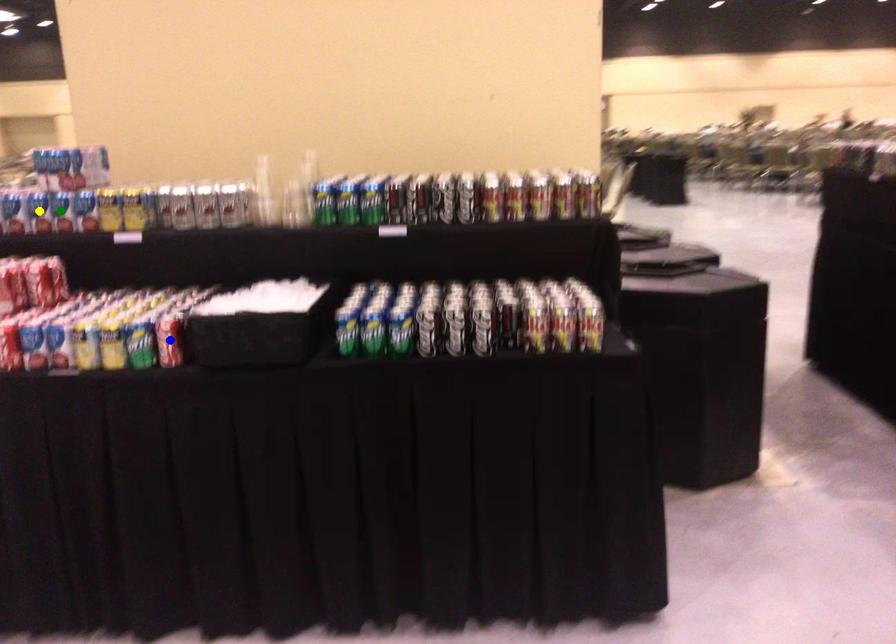
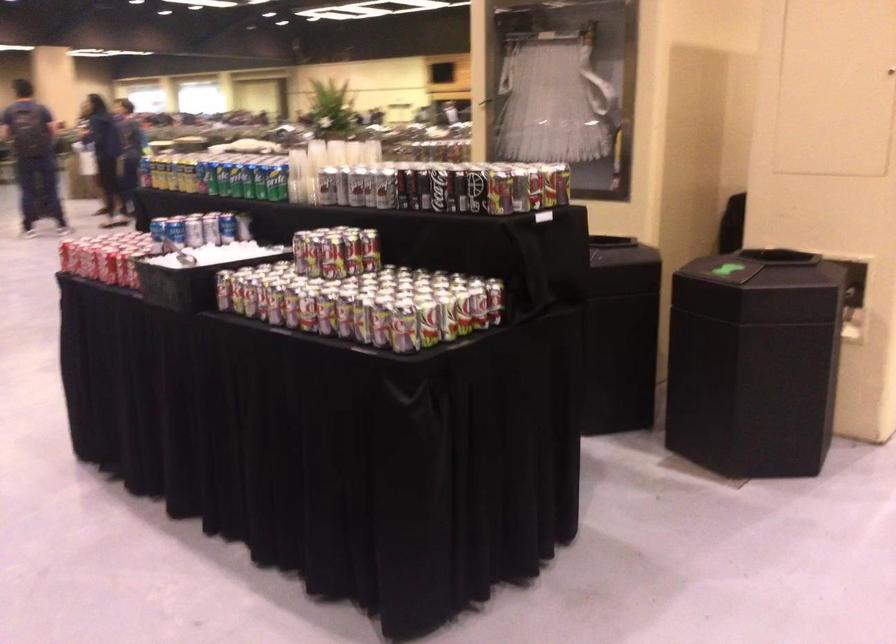
I am providing you with two images of the same scene from different viewpoints. Three points are marked in image1. Which point corresponds to a part or object that is occluded in image2?In image1, three points are marked. Which of them correspond to a part or object that is occluded in image2?Among the three points shown in image1, which one corresponds to a part or object that is no longer visible due to occlusion in image2?

yellow point, blue point, green point